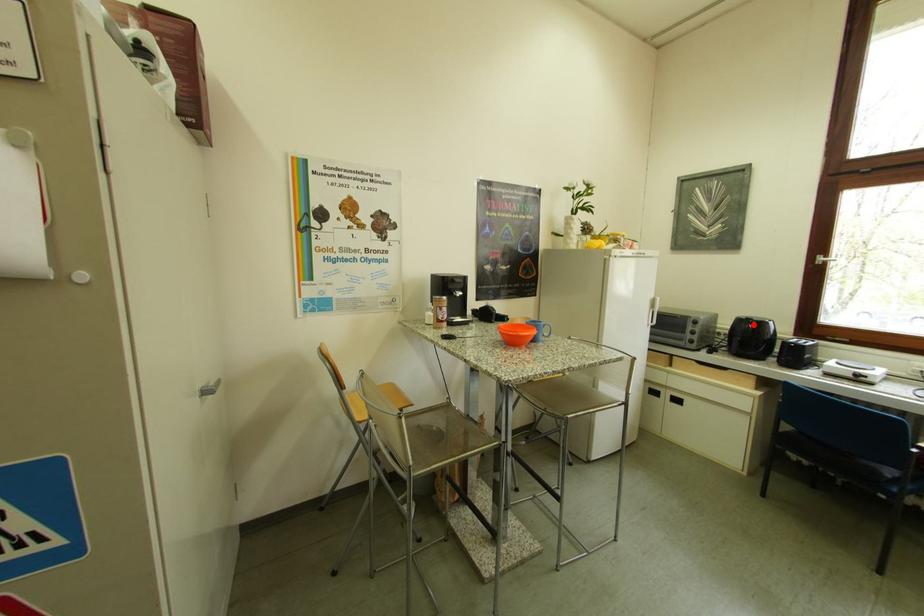
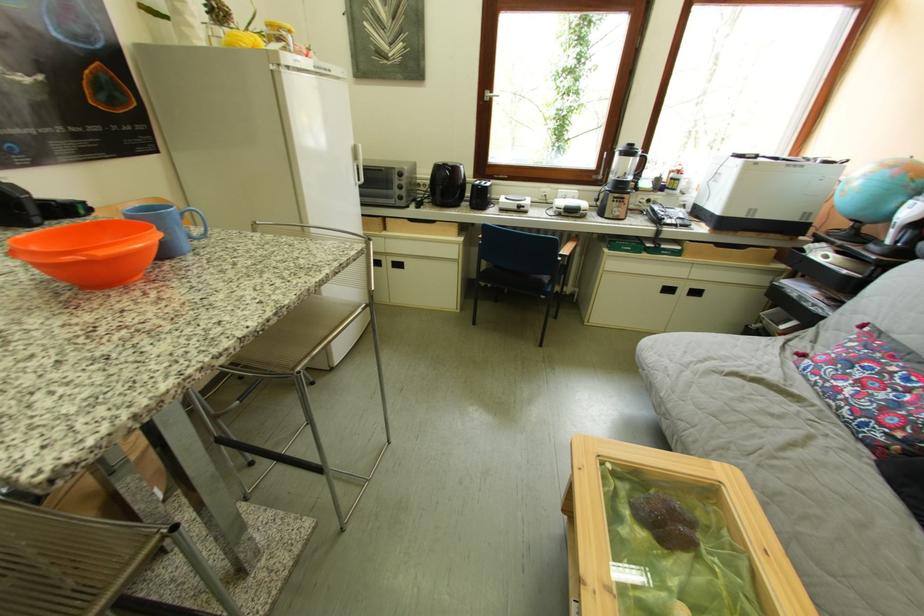
In the second image, find the point that corresponds to the highlighted location in the first image.

(451, 171)